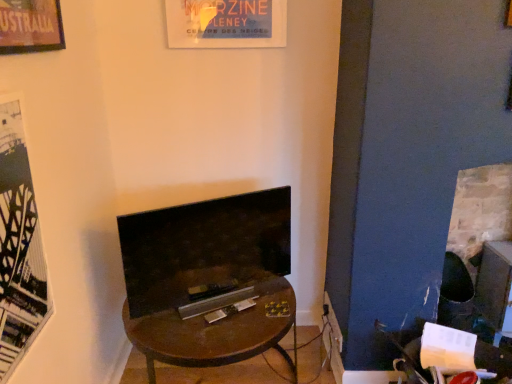
Identify the location of vacant space to the right of metallic silver magazine at center. (267, 304).